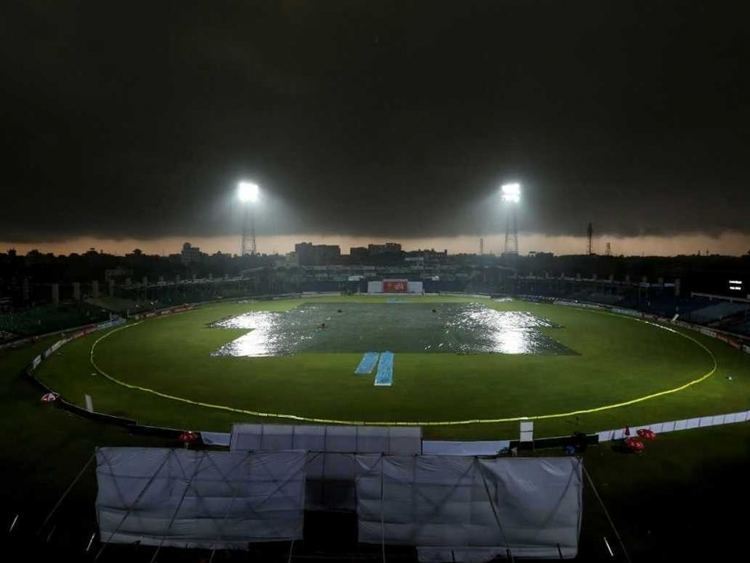
I want to click on wall, so (x=135, y=428).